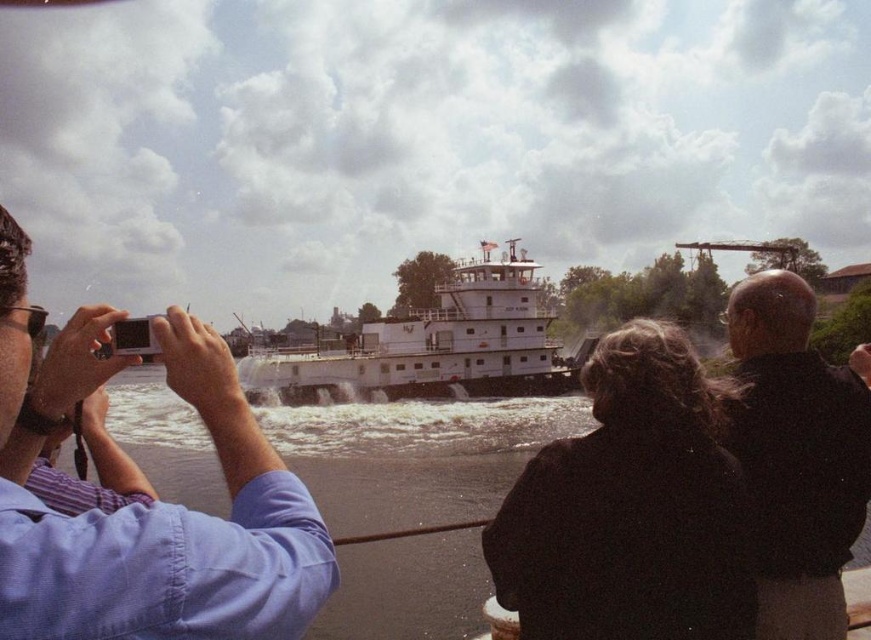
Question: Does matte white camera at left have a larger size compared to white matte tugboat at center?

Choices:
 (A) yes
 (B) no

Answer: (B)

Question: Does matte white camera at left appear over black leather jacket at upper right?

Choices:
 (A) no
 (B) yes

Answer: (A)

Question: Which point is closer to the camera taking this photo?

Choices:
 (A) (815, 408)
 (B) (525, 372)
 (C) (78, 528)

Answer: (C)

Question: Which object is farther from the camera taking this photo?

Choices:
 (A) black leather jacket at upper right
 (B) matte white camera at left
 (C) white matte tugboat at center

Answer: (C)

Question: Is matte white camera at left below white matte tugboat at center?

Choices:
 (A) yes
 (B) no

Answer: (A)

Question: Considering the real-world distances, which object is farthest from the white matte tugboat at center?

Choices:
 (A) matte white camera at left
 (B) black leather jacket at upper right

Answer: (A)